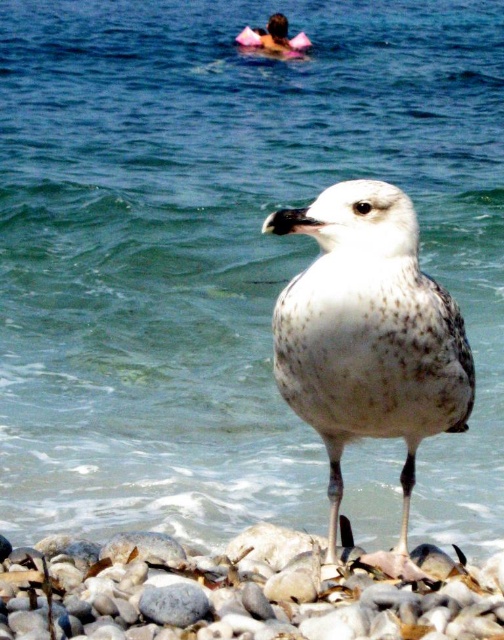
You are standing on the beach and see the smooth gray rock at lower center and the white speckled feathered bird at center. Which object is positioned to the left when facing the scene?

The smooth gray rock at lower center is to the left of the white speckled feathered bird at center.

You are a photographer aiming to capture the seagull in the coastal scene. To ensure the seagull is centered in your photo, you need to adjust your camera. Given the smooth gray rock at lower center is at point 0.925, 0.474, what should you do to position the seagull at the center?

The smooth gray rock at lower center is located at coordinates (238,592). Since the seagull is in the foreground and the rock is at lower center, moving the camera upwards would bring the seagull closer to the center of the frame.

You are a birdwatcher standing near the seagull in the scene. You want to place a small camera on the smooth gray rock at lower center to take a photo of the white speckled feathered bird at center. Is the rock a suitable spot for the camera?

The smooth gray rock at lower center is positioned under the white speckled feathered bird at center, so placing the camera there would allow for a clear photo of the bird since the rock is directly beneath it.